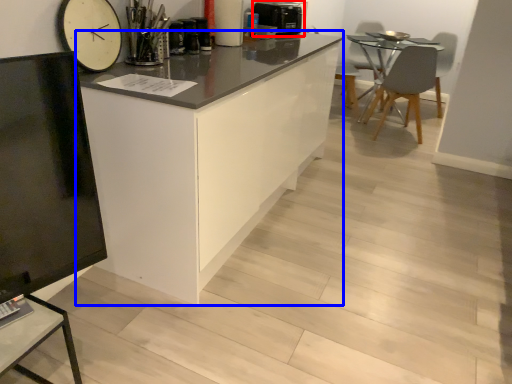
Question: Which object appears closest to the camera in this image, appliance (highlighted by a red box) or cabinetry (highlighted by a blue box)?

Choices:
 (A) appliance
 (B) cabinetry

Answer: (B)